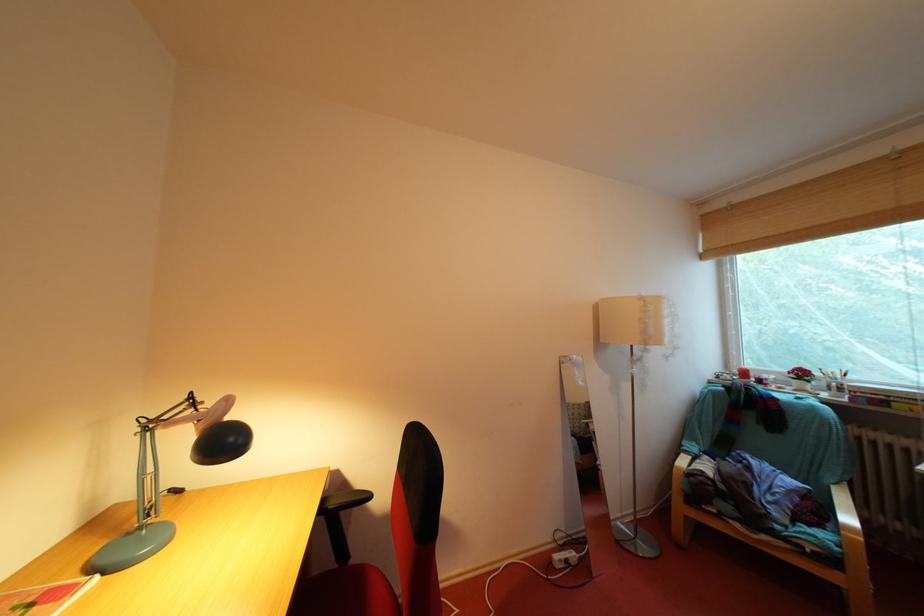
Which object does [744,373] point to?

It refers to a red cup.